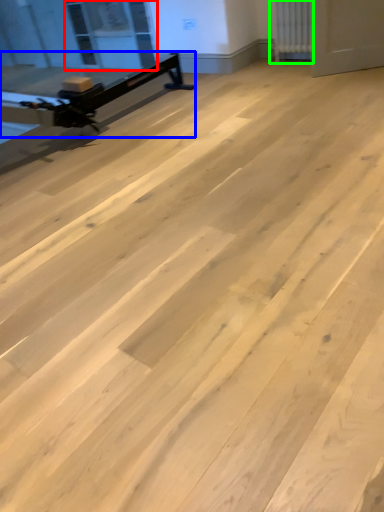
Question: Based on their relative distances, which object is farther from window screen (highlighted by a red box)? Choose from furniture (highlighted by a blue box) and radiator (highlighted by a green box).

Choices:
 (A) furniture
 (B) radiator

Answer: (B)